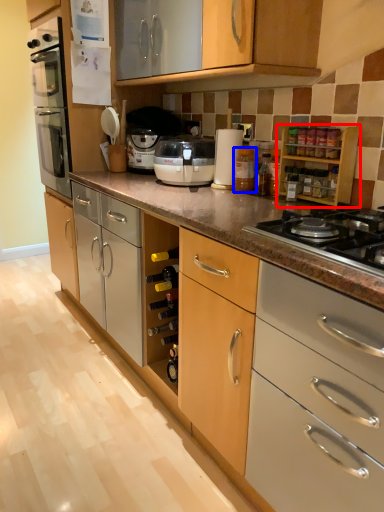
Question: Among these objects, which one is nearest to the camera, cabinetry (highlighted by a red box) or bottle (highlighted by a blue box)?

Choices:
 (A) cabinetry
 (B) bottle

Answer: (A)